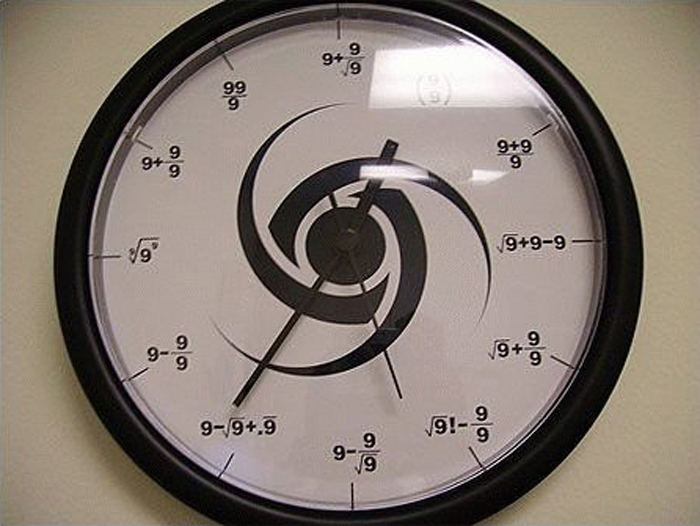
Locate an element on the screen. This screenshot has height=526, width=700. photo of a mathematical looking clock is located at coordinates (456, 160).